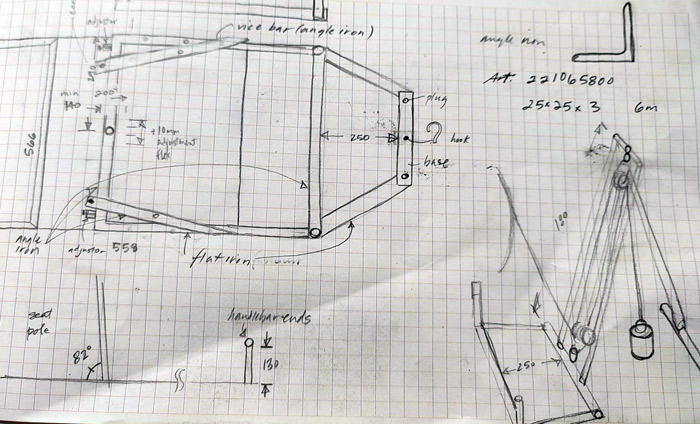
The image size is (700, 424). Find the location of `hook`. hook is located at coordinates (437, 133).